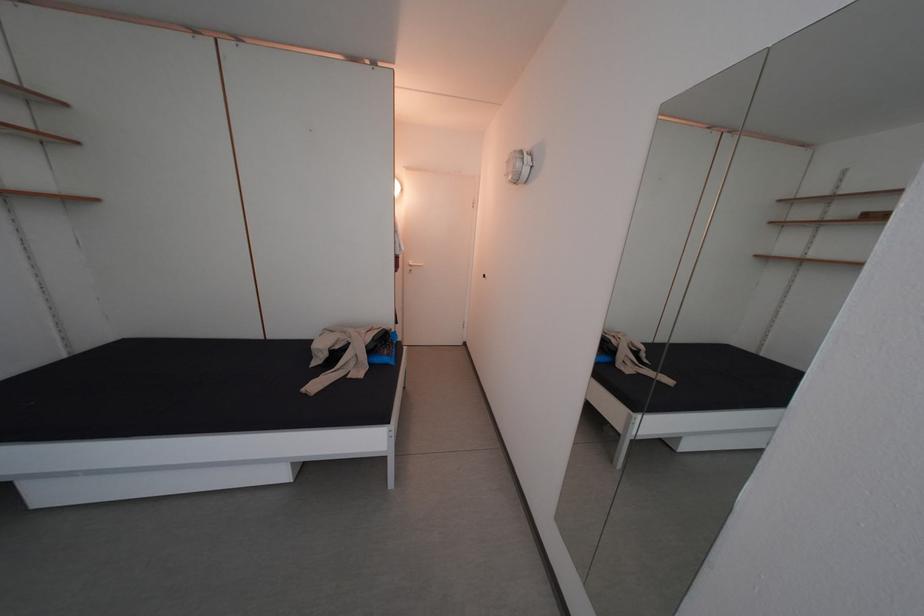
Find where to turn the white door handle. Please return your answer as a coordinate pair (x, y).

(412, 265)